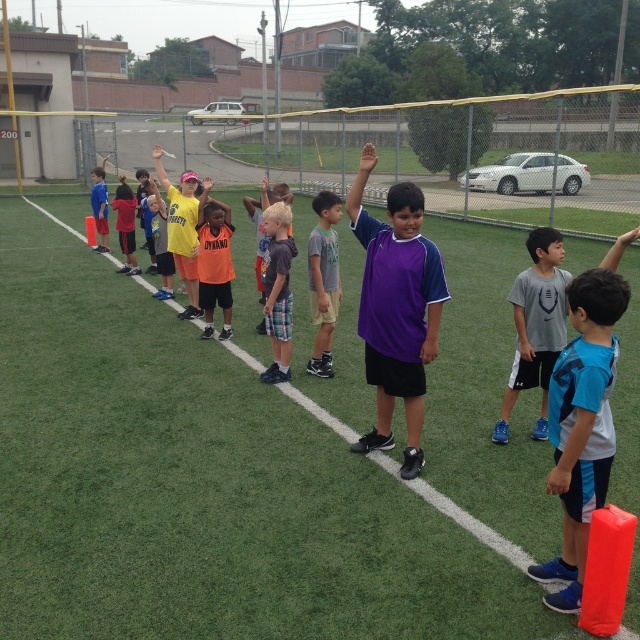
This screenshot has height=640, width=640. What do you see at coordinates (396, 308) in the screenshot?
I see `purple jersey at center` at bounding box center [396, 308].

Measure the distance between point (408, 385) and camera.

Point (408, 385) is 5.79 meters from camera.

Where is `purple jersey at center`? The image size is (640, 640). purple jersey at center is located at coordinates (396, 308).

Between gray matte t-shirt at center and yellow matte shirt at center, which one is positioned higher?

yellow matte shirt at center

You are a GUI agent. You are given a task and a screenshot of the screen. Output one action in this format:
    pyautogui.click(x=<x>, y=<y>)
    Task: Click on the gray matte t-shirt at center
    The width and height of the screenshot is (640, 640).
    Given the screenshot: What is the action you would take?
    pyautogui.click(x=536, y=324)

This screenshot has width=640, height=640. I want to click on gray matte t-shirt at center, so click(536, 324).

Which is below, orange jersey at center or matte blue shirt at center?

orange jersey at center

Based on the photo, does orange jersey at center lie behind matte blue shirt at center?

That is False.

This screenshot has width=640, height=640. What do you see at coordinates (214, 262) in the screenshot?
I see `orange jersey at center` at bounding box center [214, 262].

You are a GUI agent. You are given a task and a screenshot of the screen. Output one action in this format:
    pyautogui.click(x=<x>, y=<y>)
    Task: Click on the orange jersey at center
    The height and width of the screenshot is (640, 640).
    Given the screenshot: What is the action you would take?
    pos(214,262)